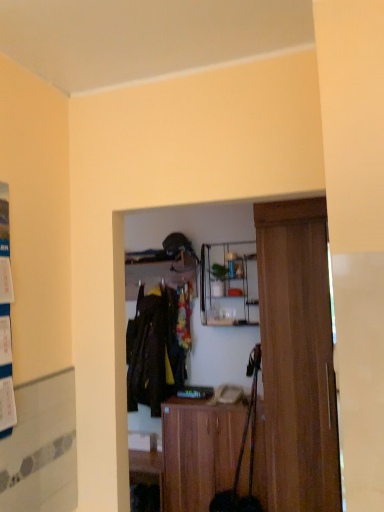
What is the approximate height of wooden cabinet at center?

It is 32.96 inches.

The height and width of the screenshot is (512, 384). What do you see at coordinates (243, 452) in the screenshot? I see `matte black tripod at center` at bounding box center [243, 452].

At what (x,y) coordinates should I click in order to perform the action: click on wooden door at right. Please return your answer as a coordinate pair (x, y). This screenshot has height=512, width=384. Looking at the image, I should click on (297, 356).

You are a GUI agent. You are given a task and a screenshot of the screen. Output one action in this format:
    pyautogui.click(x=<x>, y=<y>)
    Task: Click on the wooden shelf at center, the 2th shelf in the right-to-left sequence
    The image size is (384, 512).
    Given the screenshot: What is the action you would take?
    pyautogui.click(x=158, y=270)

Identify the location of white paper poster at left. (5, 320).

This screenshot has height=512, width=384. I want to click on dark brown fabric coat at center, so click(x=154, y=351).

At what (x,y) coordinates should I click in order to perform the action: click on poster located in front of the dark brown fabric coat at center. Please return your answer as a coordinate pair (x, y). This screenshot has width=384, height=512. Looking at the image, I should click on (5, 320).

From the image's perspective, who appears lower, dark brown fabric coat at center or white paper poster at left?

dark brown fabric coat at center.

From a real-world perspective, which object rests below the other?

dark brown fabric coat at center, from a real-world perspective.

Is dark brown fabric coat at center positioned far away from white paper poster at left?

That's right, there is a large distance between dark brown fabric coat at center and white paper poster at left.

Considering the positions of objects wooden shelf at center, the 2th shelf in the right-to-left sequence, and matte black tripod at center in the image provided, who is behind, wooden shelf at center, the 2th shelf in the right-to-left sequence, or matte black tripod at center?

wooden shelf at center, the 2th shelf in the right-to-left sequence, is further away from the camera.

Identify the location of the 2nd shelf to the left when counting from the matte black tripod at center. (x=158, y=270).

Is wooden shelf at center, the 2th shelf in the right-to-left sequence, taller than matte black tripod at center?

No.

Is dark brown fabric coat at center looking in the opposite direction of clear glass shelf at center, the 1th shelf from the right?

No, dark brown fabric coat at center's orientation is not away from clear glass shelf at center, the 1th shelf from the right.

Consider the image. Can you confirm if dark brown fabric coat at center is wider than clear glass shelf at center, the 1th shelf from the right?

In fact, dark brown fabric coat at center might be narrower than clear glass shelf at center, the 1th shelf from the right.

In the image, is dark brown fabric coat at center positioned in front of or behind clear glass shelf at center, the 1th shelf from the right?

dark brown fabric coat at center is positioned farther from the viewer than clear glass shelf at center, the 1th shelf from the right.

Do you think wooden shelf at center, the 2th shelf in the right-to-left sequence, is within wooden door at right, or outside of it?

wooden shelf at center, the 2th shelf in the right-to-left sequence, lies outside wooden door at right.

Can you confirm if wooden shelf at center, the 1th shelf when ordered from left to right, is bigger than wooden door at right?

Incorrect, wooden shelf at center, the 1th shelf when ordered from left to right, is not larger than wooden door at right.

The image size is (384, 512). In the image, there is a wooden shelf at center, the 2th shelf in the right-to-left sequence. Find the location of `door below it (from the image's perspective)`. door below it (from the image's perspective) is located at coordinates (297, 356).

Which is behind, point (155, 391) or point (240, 419)?

The point (155, 391) is farther.

From a real-world perspective, who is located higher, dark brown fabric coat at center or wooden cabinet at center?

dark brown fabric coat at center is physically above.

From the picture: From their relative heights in the image, would you say dark brown fabric coat at center is taller or shorter than wooden cabinet at center?

dark brown fabric coat at center is taller than wooden cabinet at center.

Is wooden cabinet at center inside dark brown fabric coat at center?

That's incorrect, wooden cabinet at center is not inside dark brown fabric coat at center.

From the picture: From the image's perspective, does matte black tripod at center appear lower than clear glass shelf at center, the 2th shelf viewed from the left?

Indeed, from the image's perspective, matte black tripod at center is shown beneath clear glass shelf at center, the 2th shelf viewed from the left.

Considering the relative sizes of matte black tripod at center and clear glass shelf at center, the 1th shelf from the right, in the image provided, is matte black tripod at center shorter than clear glass shelf at center, the 1th shelf from the right,?

In fact, matte black tripod at center may be taller than clear glass shelf at center, the 1th shelf from the right.

From the image's perspective, starting from the matte black tripod at center, which shelf is the 1st one above? Please provide its 2D coordinates.

[(229, 284)]

Based on their positions, is matte black tripod at center located to the left or right of clear glass shelf at center, the 1th shelf from the right?

Clearly, matte black tripod at center is on the right of clear glass shelf at center, the 1th shelf from the right, in the image.

Looking at this image, which is more to the left, clear glass shelf at center, the 2th shelf viewed from the left, or wooden shelf at center, the 1th shelf when ordered from left to right?

wooden shelf at center, the 1th shelf when ordered from left to right.

Where is `shelf below the wooden shelf at center, the 1th shelf when ordered from left to right (from the image's perspective)`? shelf below the wooden shelf at center, the 1th shelf when ordered from left to right (from the image's perspective) is located at coordinates (229, 284).

From a real-world perspective, relative to wooden shelf at center, the 2th shelf in the right-to-left sequence, is clear glass shelf at center, the 2th shelf viewed from the left, vertically above or below?

clear glass shelf at center, the 2th shelf viewed from the left, is below wooden shelf at center, the 2th shelf in the right-to-left sequence.

What's the angular difference between clear glass shelf at center, the 2th shelf viewed from the left, and wooden shelf at center, the 1th shelf when ordered from left to right,'s facing directions?

0.000238 degrees separate the facing orientations of clear glass shelf at center, the 2th shelf viewed from the left, and wooden shelf at center, the 1th shelf when ordered from left to right.

Find the location of a particular element. Image resolution: width=384 pixels, height=512 pixels. poster located in front of the dark brown fabric coat at center is located at coordinates (5, 320).

At what (x,y) coordinates should I click in order to perform the action: click on luggage below the wooden shelf at center, the 2th shelf in the right-to-left sequence (from the image's perspective). Please return your answer as a coordinate pair (x, y). This screenshot has height=512, width=384. Looking at the image, I should click on (243, 452).

Based on their spatial positions, is wooden door at right or clear glass shelf at center, the 2th shelf viewed from the left, further from white paper poster at left?

clear glass shelf at center, the 2th shelf viewed from the left.

In the scene shown: Looking at the image, which one is located further to matte black tripod at center, dark brown fabric coat at center or clear glass shelf at center, the 1th shelf from the right?

dark brown fabric coat at center.

Based on their spatial positions, is dark brown fabric coat at center or white paper poster at left further from wooden shelf at center, the 2th shelf in the right-to-left sequence?

Among the two, white paper poster at left is located further to wooden shelf at center, the 2th shelf in the right-to-left sequence.

Considering their positions, is wooden shelf at center, the 2th shelf in the right-to-left sequence, positioned closer to clear glass shelf at center, the 1th shelf from the right, than matte black tripod at center?

wooden shelf at center, the 2th shelf in the right-to-left sequence.

Estimate the real-world distances between objects in this image. Which object is further from clear glass shelf at center, the 2th shelf viewed from the left, dark brown fabric coat at center or wooden shelf at center, the 2th shelf in the right-to-left sequence?

dark brown fabric coat at center.

Considering their positions, is white paper poster at left positioned closer to clear glass shelf at center, the 2th shelf viewed from the left, than wooden shelf at center, the 1th shelf when ordered from left to right?

wooden shelf at center, the 1th shelf when ordered from left to right, is closer to clear glass shelf at center, the 2th shelf viewed from the left.

When comparing their distances from dark brown fabric coat at center, does white paper poster at left or wooden cabinet at center seem closer?

wooden cabinet at center lies closer to dark brown fabric coat at center than the other object.

Based on their spatial positions, is wooden cabinet at center or wooden door at right further from matte black tripod at center?

wooden door at right is further to matte black tripod at center.

Find the location of a particular element. The width and height of the screenshot is (384, 512). shelf between dark brown fabric coat at center and clear glass shelf at center, the 1th shelf from the right, from left to right is located at coordinates (158, 270).

Identify the location of clothing between white paper poster at left and wooden shelf at center, the 2th shelf in the right-to-left sequence, from front to back. (154, 351).

Find the location of a particular element. luggage that lies between clear glass shelf at center, the 1th shelf from the right, and wooden cabinet at center from top to bottom is located at coordinates (243, 452).

I want to click on door located between white paper poster at left and dark brown fabric coat at center in the depth direction, so click(297, 356).